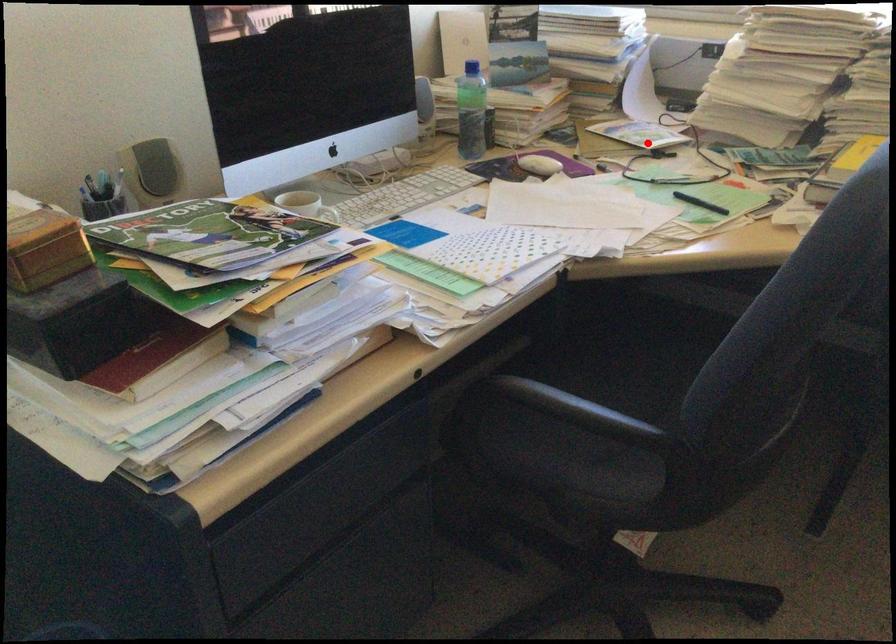
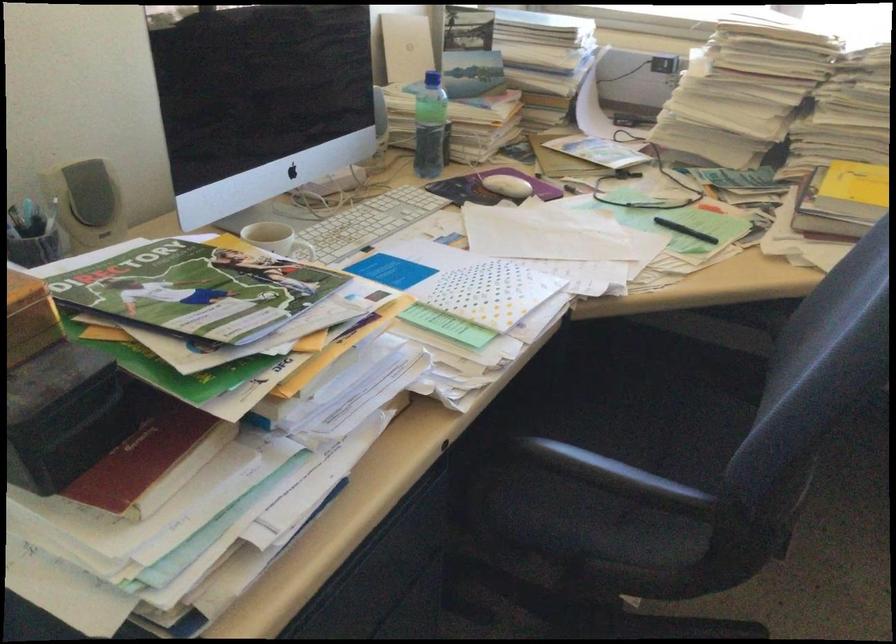
Find the pixel in the second image that matches the highlighted location in the first image.

(610, 166)